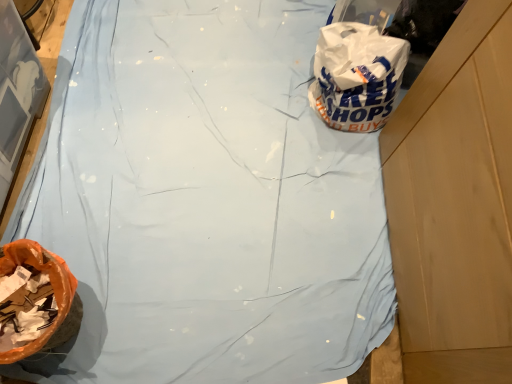
This screenshot has height=384, width=512. Identify the location of white plastic bag at upper right. (356, 76).

This screenshot has width=512, height=384. What do you see at coordinates (356, 76) in the screenshot?
I see `white plastic bag at upper right` at bounding box center [356, 76].

Image resolution: width=512 pixels, height=384 pixels. Find the location of `orange plastic bag at lower left`. orange plastic bag at lower left is located at coordinates (52, 284).

The height and width of the screenshot is (384, 512). What do you see at coordinates (52, 284) in the screenshot? I see `orange plastic bag at lower left` at bounding box center [52, 284].

In order to click on white plastic bag at upper right in this screenshot , I will do [356, 76].

In the image, is white plastic bag at upper right on the left side or the right side of orange plastic bag at lower left?

white plastic bag at upper right is to the right of orange plastic bag at lower left.

Between white plastic bag at upper right and orange plastic bag at lower left, which one is positioned behind?

white plastic bag at upper right.

Does point (384, 39) appear closer or farther from the camera than point (64, 297)?

Clearly, point (384, 39) is more distant from the camera than point (64, 297).

From the image's perspective, who appears lower, white plastic bag at upper right or orange plastic bag at lower left?

orange plastic bag at lower left.

Consider the image. From a real-world perspective, which is physically above, white plastic bag at upper right or orange plastic bag at lower left?

In real-world perspective, orange plastic bag at lower left is above.

Between white plastic bag at upper right and orange plastic bag at lower left, which one has larger width?

Wider between the two is white plastic bag at upper right.

Between white plastic bag at upper right and orange plastic bag at lower left, which one has more height?

With more height is orange plastic bag at lower left.

Can you confirm if white plastic bag at upper right is smaller than orange plastic bag at lower left?

Actually, white plastic bag at upper right might be larger than orange plastic bag at lower left.

Is orange plastic bag at lower left inside white plastic bag at upper right?

No, orange plastic bag at lower left is not a part of white plastic bag at upper right.

Is white plastic bag at upper right next to orange plastic bag at lower left and touching it?

There is a gap between white plastic bag at upper right and orange plastic bag at lower left.

Is white plastic bag at upper right oriented towards orange plastic bag at lower left?

No.

How many degrees apart are the facing directions of white plastic bag at upper right and orange plastic bag at lower left?

white plastic bag at upper right and orange plastic bag at lower left are facing 92.2 degrees away from each other.

You are a GUI agent. You are given a task and a screenshot of the screen. Output one action in this format:
    pyautogui.click(x=<x>, y=<y>)
    Task: Click on the plastic bag behind the orange plastic bag at lower left
    The height and width of the screenshot is (384, 512).
    Given the screenshot: What is the action you would take?
    pyautogui.click(x=356, y=76)

Considering the relative positions of orange plastic bag at lower left and white plastic bag at upper right in the image provided, is orange plastic bag at lower left to the left of white plastic bag at upper right from the viewer's perspective?

Yes.

Which is behind, orange plastic bag at lower left or white plastic bag at upper right?

white plastic bag at upper right is further away from the camera.

Between point (46, 340) and point (343, 43), which one is positioned behind?

The point (343, 43) is farther.

From the image's perspective, would you say orange plastic bag at lower left is shown under white plastic bag at upper right?

Yes, from the image's perspective, orange plastic bag at lower left is beneath white plastic bag at upper right.

From a real-world perspective, is orange plastic bag at lower left on white plastic bag at upper right?

Yes, from a real-world perspective, orange plastic bag at lower left is above white plastic bag at upper right.

Consider the image. Which of these two, orange plastic bag at lower left or white plastic bag at upper right, is wider?

white plastic bag at upper right.

Can you confirm if orange plastic bag at lower left is shorter than white plastic bag at upper right?

No, orange plastic bag at lower left is not shorter than white plastic bag at upper right.

Does orange plastic bag at lower left have a larger size compared to white plastic bag at upper right?

Incorrect, orange plastic bag at lower left is not larger than white plastic bag at upper right.

Is orange plastic bag at lower left inside or outside of white plastic bag at upper right?

orange plastic bag at lower left is outside white plastic bag at upper right.

Are orange plastic bag at lower left and white plastic bag at upper right beside each other?

No, orange plastic bag at lower left is not next to white plastic bag at upper right.

Is orange plastic bag at lower left facing towards white plastic bag at upper right?

No, orange plastic bag at lower left is not oriented towards white plastic bag at upper right.

How far apart are orange plastic bag at lower left and white plastic bag at upper right?

The distance of orange plastic bag at lower left from white plastic bag at upper right is 36.50 inches.

Locate an element on the screen. This screenshot has width=512, height=384. plastic bag behind the orange plastic bag at lower left is located at coordinates (356, 76).

Find the location of a particular element. The width and height of the screenshot is (512, 384). plastic bag below the orange plastic bag at lower left (from a real-world perspective) is located at coordinates (356, 76).

The height and width of the screenshot is (384, 512). What are the coordinates of `plastic bag lying behind the orange plastic bag at lower left` in the screenshot? It's located at (356, 76).